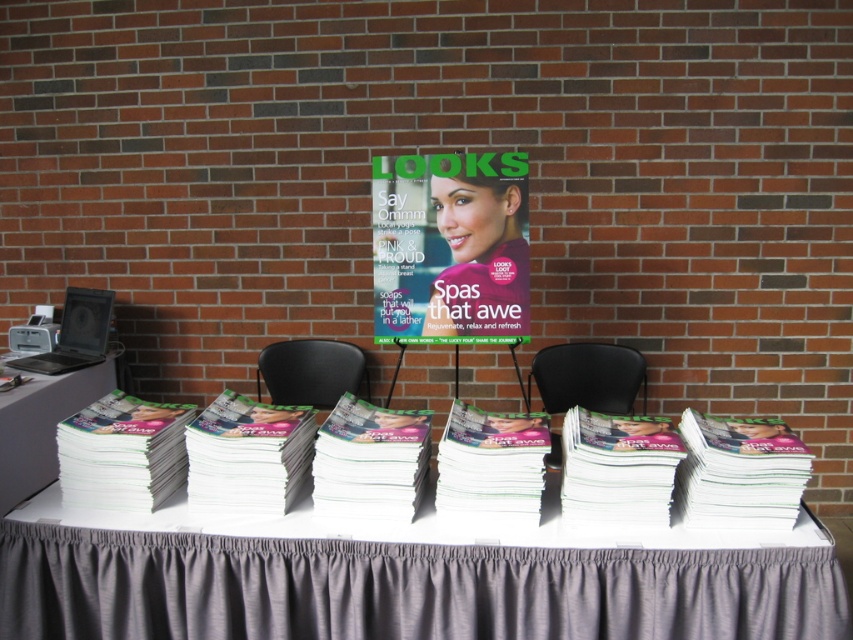
Between matte glossy magazine at center and white plastic table at left, which one has more height?

matte glossy magazine at center

Is point (520, 161) more distant than point (45, 403)?

No, it is in front of (45, 403).

Image resolution: width=853 pixels, height=640 pixels. Find the location of `matte glossy magazine at center`. matte glossy magazine at center is located at coordinates pyautogui.click(x=450, y=248).

Can you confirm if white plastic table at left is thinner than black leather chair at center?

Yes.

Can you confirm if white plastic table at left is positioned above black leather chair at center?

Actually, white plastic table at left is below black leather chair at center.

Which is behind, point (0, 394) or point (534, 365)?

The point (534, 365) is more distant.

The image size is (853, 640). What are the coordinates of `white plastic table at left` in the screenshot? It's located at (41, 426).

Is point (519, 609) positioned behind point (463, 323)?

No, (519, 609) is in front of (463, 323).

Who is more forward, (173, 548) or (428, 180)?

Point (173, 548) is in front.

Where is `gray fabric tablecloth at center`? The height and width of the screenshot is (640, 853). gray fabric tablecloth at center is located at coordinates (397, 588).